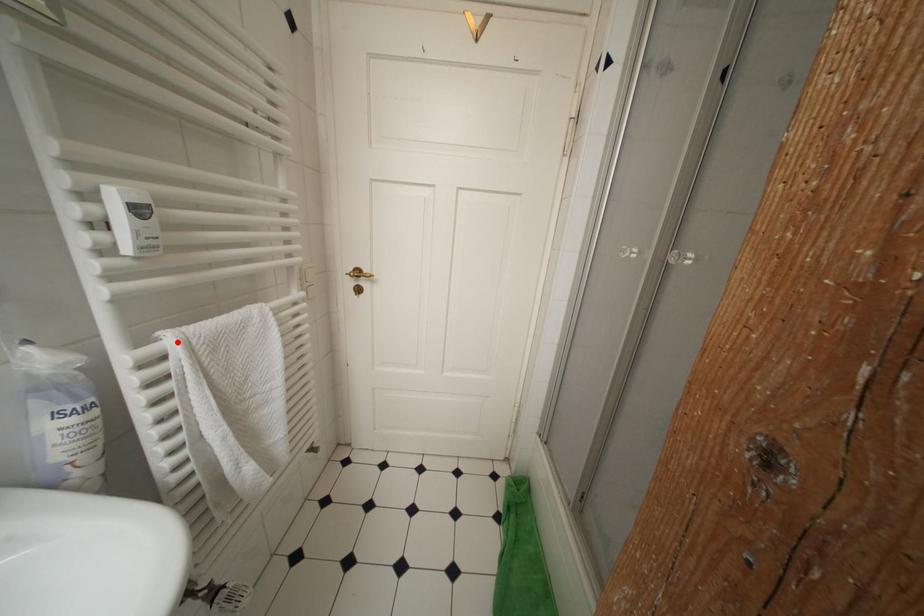
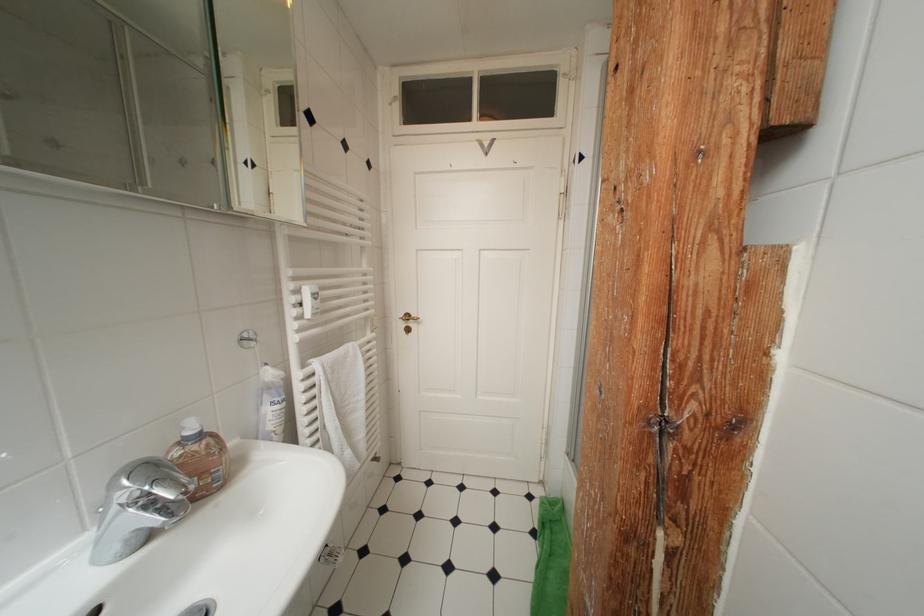
In the second image, find the point that corresponds to the highlighted location in the first image.

(322, 368)